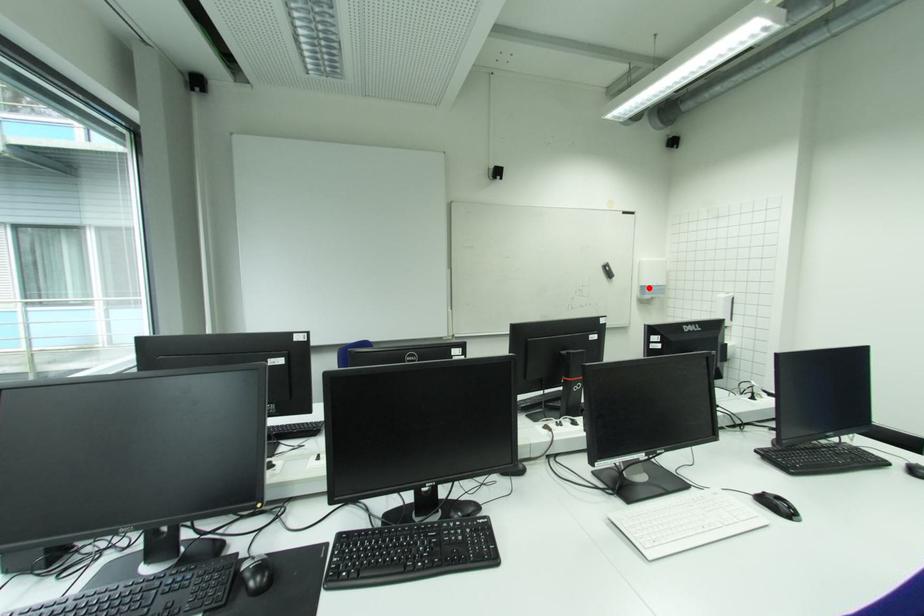
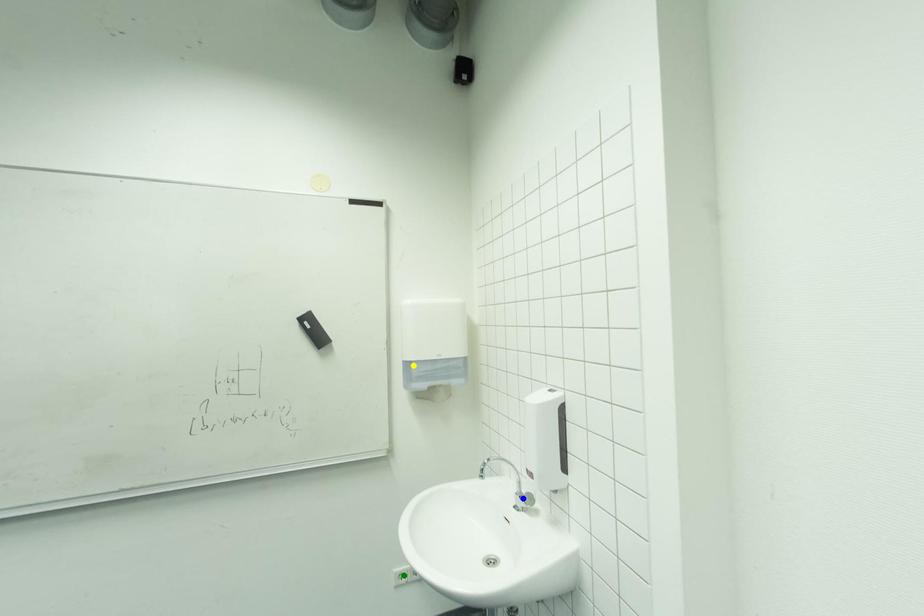
Question: I am providing you with two images of the same scene from different viewpoints. A red point is marked on the first image. You are given multiple points on the second image. Which spot in image 2 lines up with the point in image 1?

Choices:
 (A) blue point
 (B) green point
 (C) yellow point

Answer: (C)